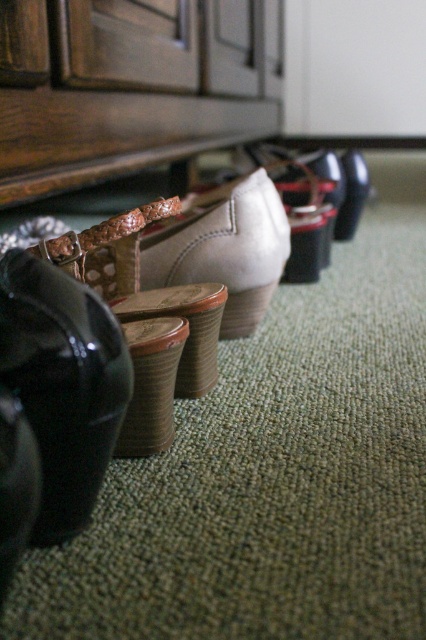
Is shiny black shoe at lower left thinner than leather/textured shoe at center?

Correct, shiny black shoe at lower left's width is less than leather/textured shoe at center's.

What do you see at coordinates (63, 385) in the screenshot? I see `shiny black shoe at lower left` at bounding box center [63, 385].

Where is `shiny black shoe at lower left`? shiny black shoe at lower left is located at coordinates [63, 385].